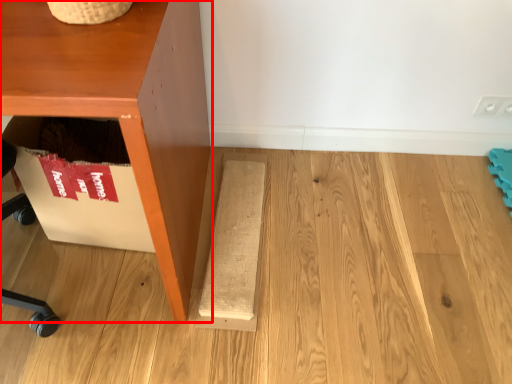
Question: Where is furniture (annotated by the red box) located in relation to plank in the image?

Choices:
 (A) left
 (B) right

Answer: (A)